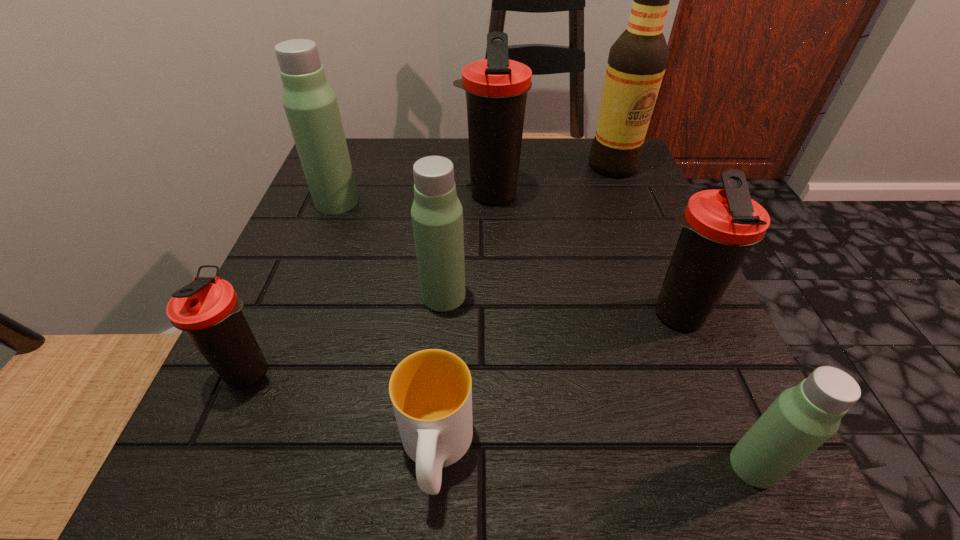
Identify the location of free space at the far edge of the desktop. The image size is (960, 540). (407, 156).

Locate an element on the screen. This screenshot has width=960, height=540. free space at the left edge of the desktop is located at coordinates (270, 316).

In the image, there is a desktop. Where is `free space at the right edge`? The image size is (960, 540). free space at the right edge is located at coordinates (634, 411).

This screenshot has width=960, height=540. What are the coordinates of `free space at the far left corner of the desktop` in the screenshot? It's located at (387, 174).

Identify the location of vacant space at the near left corner. The width and height of the screenshot is (960, 540). (194, 487).

This screenshot has width=960, height=540. I want to click on free space at the far right corner of the desktop, so point(648,189).

Identify the location of free space between the biggest brown thermos bottle and the cup. (464, 323).

Locate an element on the screen. The width and height of the screenshot is (960, 540). vacant space that is in between the second nearest brown thermos bottle and the nearest brown thermos bottle is located at coordinates (464, 343).

What are the coordinates of `empty location between the smallest light thermos bottle and the smallest brown thermos bottle` in the screenshot? It's located at (502, 418).

Identify the location of blank region between the nearest thermos bottle and the second biggest light thermos bottle. This screenshot has height=540, width=960. tap(599, 381).